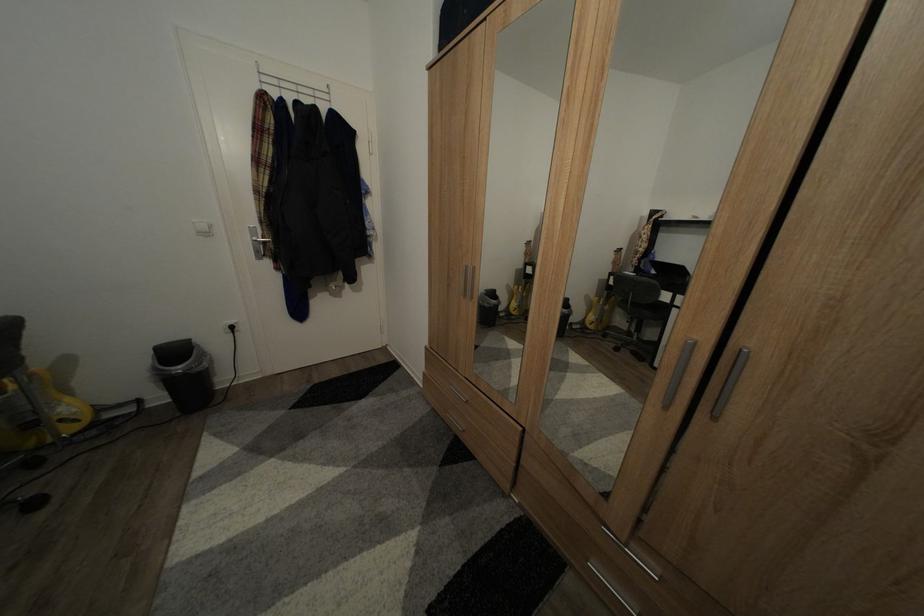
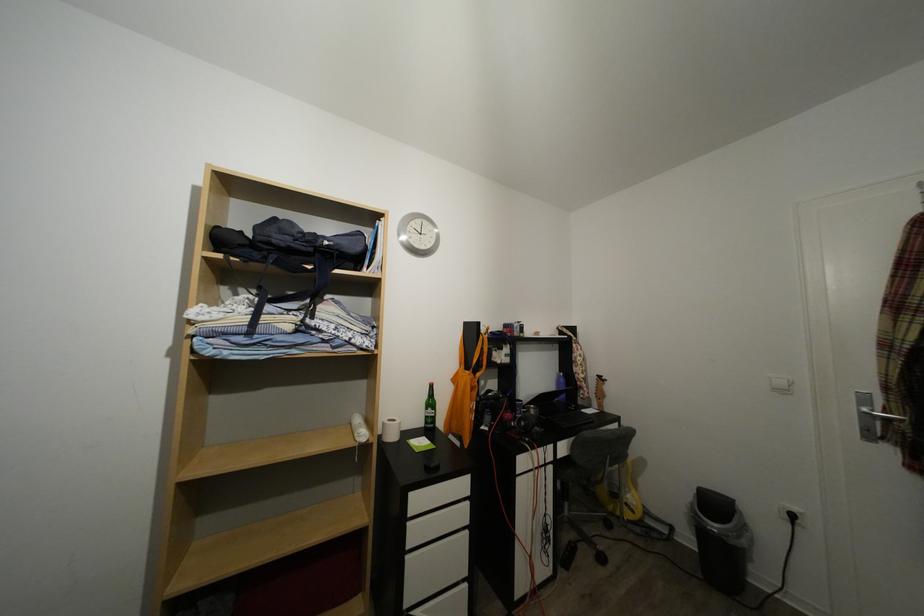
Question: The first image is from the beginning of the video and the second image is from the end. How did the camera likely rotate when shooting the video?

Choices:
 (A) Left
 (B) Right
 (C) Up
 (D) Down

Answer: (A)